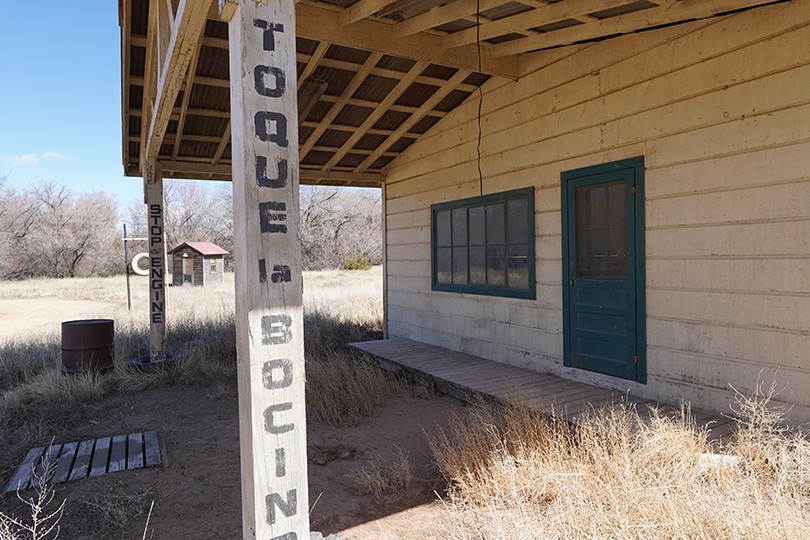
Locate an element on the screen. dark green door is located at coordinates (599, 299).